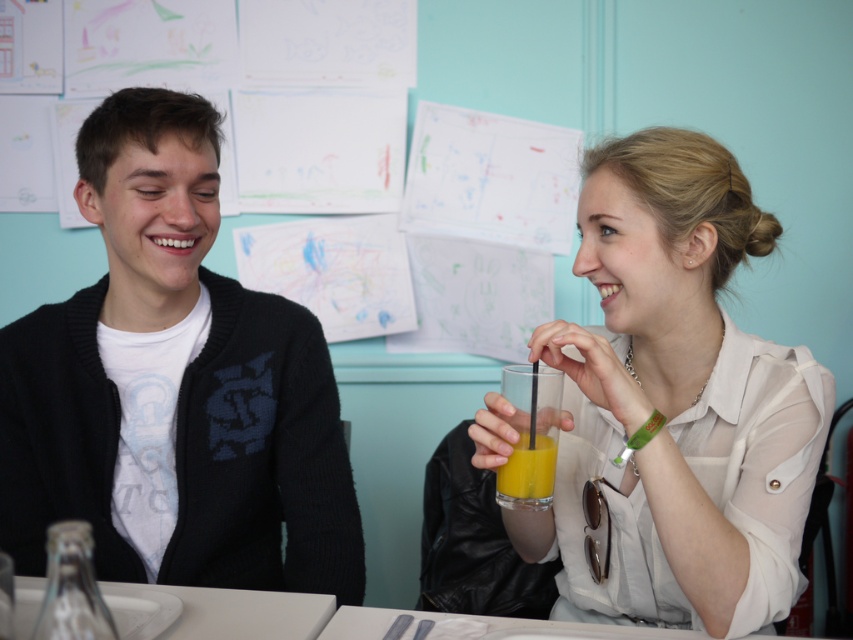
Can you confirm if translucent glass at upper center is taller than translucent glass of orange juice at center?

Indeed, translucent glass at upper center has a greater height compared to translucent glass of orange juice at center.

Is point (527, 428) closer to viewer compared to point (514, 444)?

Yes, point (527, 428) is closer to viewer.

Is point (500, 484) behind point (502, 477)?

Yes, it is.

The image size is (853, 640). Identify the location of translucent glass at upper center. (531, 436).

Can you confirm if matte white blouse at center is smaller than translucent glass at upper center?

No.

How far apart are matte white blouse at center and translucent glass at upper center?

The distance of matte white blouse at center from translucent glass at upper center is 6.90 inches.

Locate an element on the screen. The width and height of the screenshot is (853, 640). matte white blouse at center is located at coordinates (679, 401).

Which is above, white glossy table at lower center or translucent glass at upper center?

Positioned higher is translucent glass at upper center.

Who is lower down, white glossy table at lower center or translucent glass at upper center?

white glossy table at lower center

Which is behind, point (310, 604) or point (543, 385)?

Point (310, 604)

At what (x,y) coordinates should I click in order to perform the action: click on white glossy table at lower center. Please return your answer as a coordinate pair (x, y). Looking at the image, I should click on (213, 612).